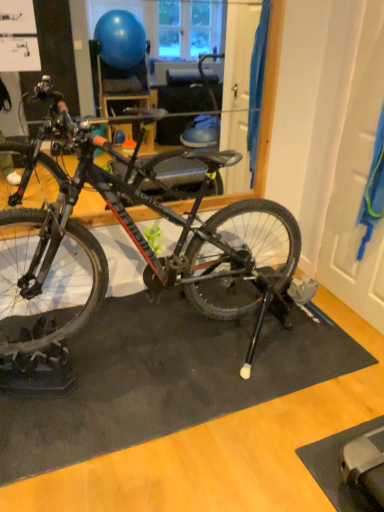
Describe the element at coordinates (135, 244) in the screenshot. I see `black matte bicycle at center` at that location.

You are a GUI agent. You are given a task and a screenshot of the screen. Output one action in this format:
    pyautogui.click(x=<x>, y=<y>)
    Task: Click on the black matte bicycle at center
    The height and width of the screenshot is (512, 384).
    Given the screenshot: What is the action you would take?
    pyautogui.click(x=135, y=244)

In order to face black matte bicycle at center, should I rotate leftwards or rightwards?

You should rotate left by 3.654 degrees.

Measure the distance between black matte bicycle at center and camera.

1.59 meters.

Measure the distance between point (157,413) and camera.

1.78 meters.

Locate an element on the screen. black rubber doormat at center is located at coordinates (164, 379).

The image size is (384, 512). Describe the element at coordinates (164, 379) in the screenshot. I see `black rubber doormat at center` at that location.

Where is `black matte bicycle at center`? This screenshot has width=384, height=512. black matte bicycle at center is located at coordinates point(135,244).

Between black matte bicycle at center and black rubber doormat at center, which one appears on the right side from the viewer's perspective?

Positioned to the right is black rubber doormat at center.

Considering the positions of objects black matte bicycle at center and black rubber doormat at center in the image provided, who is in front, black matte bicycle at center or black rubber doormat at center?

black matte bicycle at center is more forward.

Is point (277, 264) closer or farther from the camera than point (159, 424)?

Point (277, 264) appears to be farther away from the viewer than point (159, 424).

In the scene shown: From the image's perspective, does black matte bicycle at center appear lower than black rubber doormat at center?

No, from the image's perspective, black matte bicycle at center is not beneath black rubber doormat at center.

From a real-world perspective, who is located higher, black matte bicycle at center or black rubber doormat at center?

black matte bicycle at center.

Between black matte bicycle at center and black rubber doormat at center, which one has smaller width?

black rubber doormat at center.

In terms of height, does black matte bicycle at center look taller or shorter compared to black rubber doormat at center?

Clearly, black matte bicycle at center is taller compared to black rubber doormat at center.

Which of these two, black matte bicycle at center or black rubber doormat at center, is bigger?

Bigger between the two is black matte bicycle at center.

Can black rubber doormat at center be found inside black matte bicycle at center?

No, black rubber doormat at center is not inside black matte bicycle at center.

Is black matte bicycle at center next to black rubber doormat at center and touching it?

No, black matte bicycle at center is not next to black rubber doormat at center.

Is black matte bicycle at center positioned with its back to black rubber doormat at center?

That's not correct — black matte bicycle at center is not looking away from black rubber doormat at center.

I want to click on bicycle on the left of black rubber doormat at center, so click(x=135, y=244).

Which object is positioned more to the right, black rubber doormat at center or black matte bicycle at center?

From the viewer's perspective, black rubber doormat at center appears more on the right side.

Does black rubber doormat at center lie in front of black matte bicycle at center?

No, it is behind black matte bicycle at center.

Between point (336, 370) and point (277, 272), which one is positioned in front?

The point (336, 370) is closer.

From the image's perspective, does black rubber doormat at center appear lower than black matte bicycle at center?

Yes, from the image's perspective, black rubber doormat at center is beneath black matte bicycle at center.

From a real-world perspective, which object stands above the other?

From a 3D spatial view, black matte bicycle at center is above.

Which of these two, black rubber doormat at center or black matte bicycle at center, is wider?

Wider between the two is black matte bicycle at center.

Considering the sizes of objects black rubber doormat at center and black matte bicycle at center in the image provided, who is taller, black rubber doormat at center or black matte bicycle at center?

With more height is black matte bicycle at center.

Which of these two, black rubber doormat at center or black matte bicycle at center, is bigger?

Bigger between the two is black matte bicycle at center.

Is black rubber doormat at center situated inside black matte bicycle at center or outside?

black rubber doormat at center exists outside the volume of black matte bicycle at center.

Can you see black rubber doormat at center touching black matte bicycle at center?

No, black rubber doormat at center is not next to black matte bicycle at center.

Is black rubber doormat at center oriented towards black matte bicycle at center?

No, black rubber doormat at center is not turned towards black matte bicycle at center.

How different are the orientations of black rubber doormat at center and black matte bicycle at center in degrees?

90 degrees separate the facing orientations of black rubber doormat at center and black matte bicycle at center.

Find the location of a particular element. The width and height of the screenshot is (384, 512). bicycle in front of the black rubber doormat at center is located at coordinates (x=135, y=244).

The height and width of the screenshot is (512, 384). I want to click on doormat on the right side of black matte bicycle at center, so click(164, 379).

You are a GUI agent. You are given a task and a screenshot of the screen. Output one action in this format:
    pyautogui.click(x=<x>, y=<y>)
    Task: Click on the doormat that appears below the black matte bicycle at center (from the image's perspective)
    This screenshot has width=384, height=512.
    Given the screenshot: What is the action you would take?
    pyautogui.click(x=164, y=379)